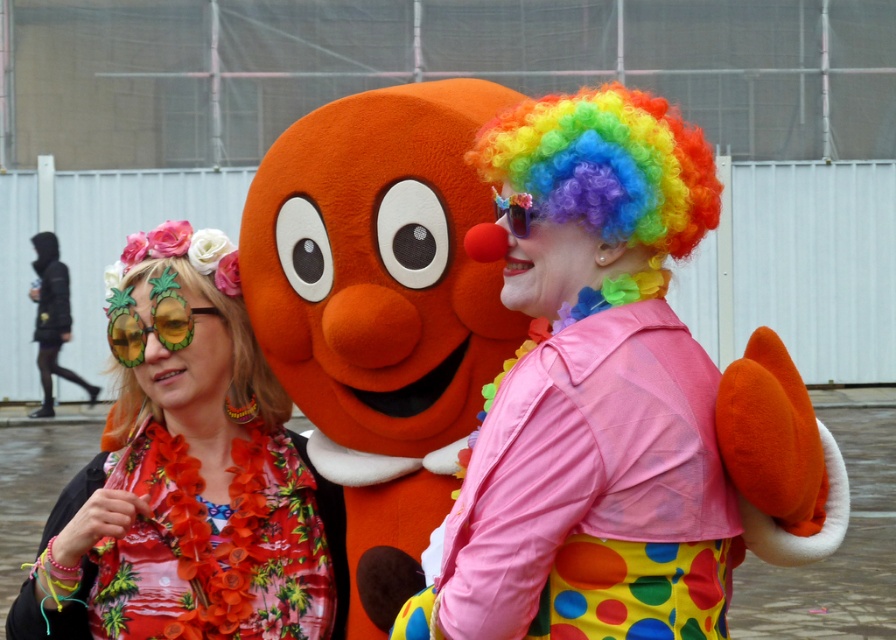
You are standing at the camera position and want to hand a gift to the person wearing the floral fabric lei at left without moving. Can you reach them with a 15 feet long stick?

The distance between the floral fabric lei at left and the camera is 14.99 feet. Since the stick is 15 feet long, you can just barely reach the person wearing the floral fabric lei at left with the stick.

You are a photographer at the event and want to capture the floral fabric lei at left and the floral fabric wig at upper left in a single shot. Which object should you focus on first to ensure both are in frame?

The floral fabric lei at left should be focused on first since it is positioned below the floral fabric wig at upper left, allowing the photographer to adjust the camera angle to include both in the frame.